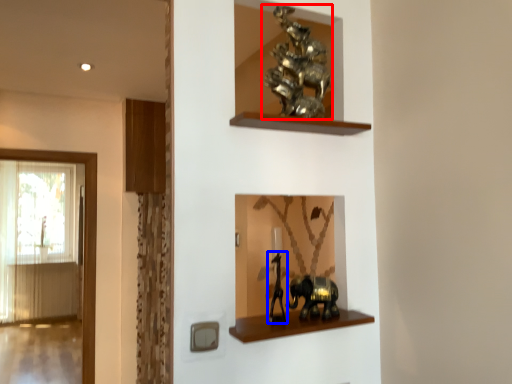
Question: Which object is closer to the camera taking this photo, animal (highlighted by a red box) or animal (highlighted by a blue box)?

Choices:
 (A) animal
 (B) animal

Answer: (B)